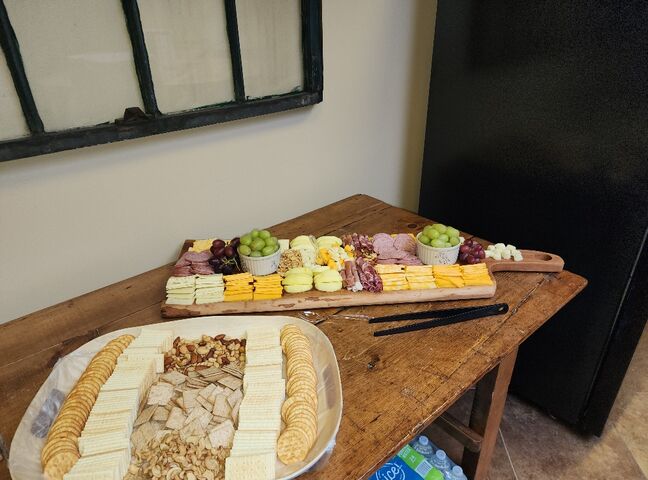
Locate an element on the screen. fridge is located at coordinates (564, 179).